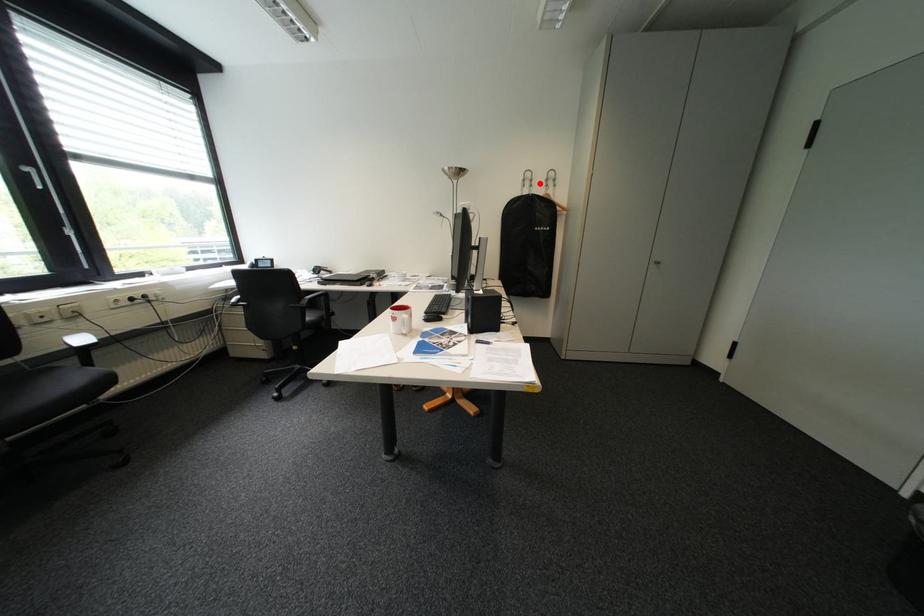
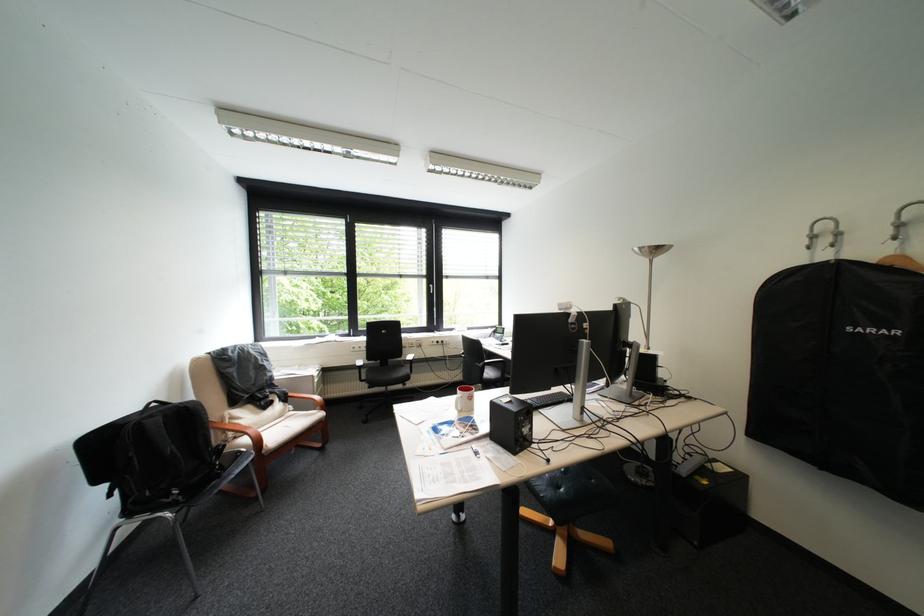
The point at the highlighted location is marked in the first image. Where is the corresponding point in the second image?

(837, 241)